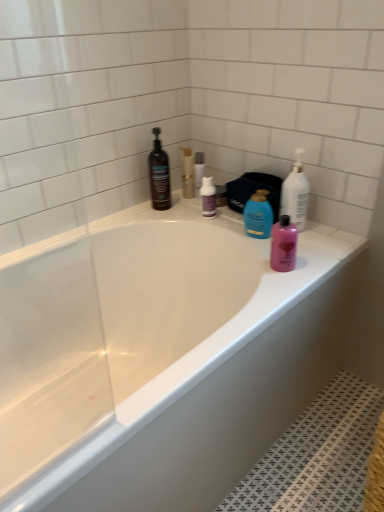
Locate an element on the screen. The width and height of the screenshot is (384, 512). vacant space in front of pink glossy bottle at right, acting as the first toiletry starting from the front is located at coordinates (279, 287).